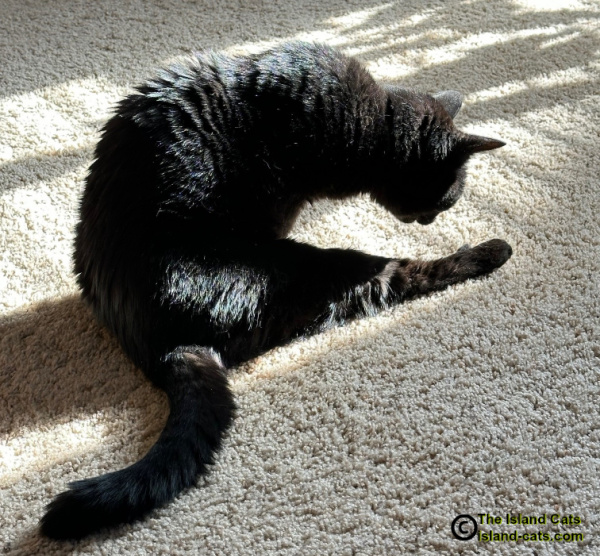
Find the location of a particular element. The image size is (600, 556). cat's shadow on the carpet is located at coordinates (50, 350).